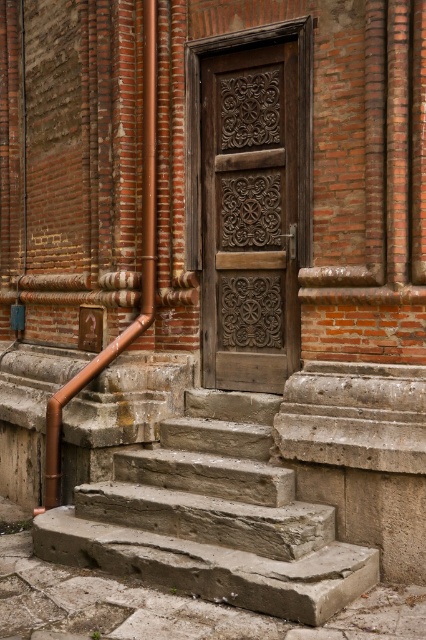
Question: Is gray stone stairs at center wider than copper pipe at left?

Choices:
 (A) no
 (B) yes

Answer: (B)

Question: Which point is farther to the camera?

Choices:
 (A) gray stone stairs at center
 (B) carved wood door at center
 (C) copper pipe at left

Answer: (C)

Question: Which is nearer to the copper pipe at left?

Choices:
 (A) gray stone stairs at center
 (B) carved wood door at center

Answer: (B)

Question: Can you confirm if gray stone stairs at center is positioned to the right of carved wood door at center?

Choices:
 (A) yes
 (B) no

Answer: (B)

Question: Does carved wood door at center appear over copper pipe at left?

Choices:
 (A) no
 (B) yes

Answer: (B)

Question: Which of these objects is positioned closest to the carved wood door at center?

Choices:
 (A) copper pipe at left
 (B) gray stone stairs at center

Answer: (A)